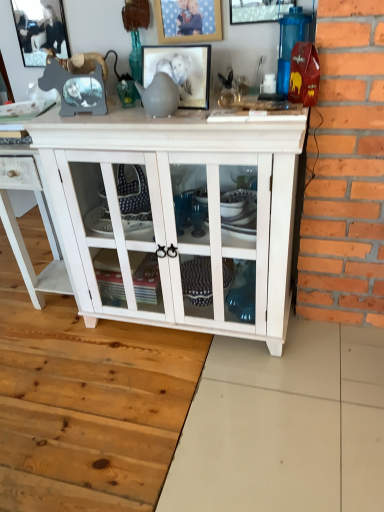
Image resolution: width=384 pixels, height=512 pixels. What do you see at coordinates (181, 71) in the screenshot?
I see `matte glass picture frame at center, which ranks as the 2th picture frame in left-to-right order` at bounding box center [181, 71].

What are the coordinates of `metallic silver picture frame at upper left, the fourth picture frame viewed from the right` in the screenshot? It's located at (40, 29).

Where is `wooden picture frame at upper center, the second picture frame from the right`? The width and height of the screenshot is (384, 512). wooden picture frame at upper center, the second picture frame from the right is located at coordinates (188, 20).

Can you confirm if white wood cupboard at center is positioned to the left of wooden picture frame at upper center, placed as the 3th picture frame when sorted from left to right?

Correct, you'll find white wood cupboard at center to the left of wooden picture frame at upper center, placed as the 3th picture frame when sorted from left to right.

The height and width of the screenshot is (512, 384). I want to click on cupboard that appears below the wooden picture frame at upper center, the second picture frame from the right (from a real-world perspective), so click(174, 209).

Which of these two, white wood cupboard at center or wooden picture frame at upper center, placed as the 3th picture frame when sorted from left to right, is smaller?

wooden picture frame at upper center, placed as the 3th picture frame when sorted from left to right, is smaller.

Is point (95, 169) positioned before point (185, 18)?

No, it is not.

Is point (30, 19) less distant than point (201, 91)?

No, it is not.

Which of these two, metallic silver picture frame at upper left, arranged as the first picture frame when viewed from the left, or matte glass picture frame at center, which ranks as the 2th picture frame in left-to-right order, is wider?

matte glass picture frame at center, which ranks as the 2th picture frame in left-to-right order, is wider.

Is metallic silver picture frame at upper left, arranged as the first picture frame when viewed from the left, surrounding matte glass picture frame at center, which is the third picture frame from right to left?

No, metallic silver picture frame at upper left, arranged as the first picture frame when viewed from the left, does not contain matte glass picture frame at center, which is the third picture frame from right to left.

In terms of size, does metallic silver picture frame at upper left, the fourth picture frame viewed from the right, appear bigger or smaller than matte glass picture frame at center, which ranks as the 2th picture frame in left-to-right order?

metallic silver picture frame at upper left, the fourth picture frame viewed from the right, is smaller than matte glass picture frame at center, which ranks as the 2th picture frame in left-to-right order.

Is metallic silver picture frame at upper center, the first picture frame in the right-to-left sequence, bigger or smaller than white wood cabinet at center?

Considering their sizes, metallic silver picture frame at upper center, the first picture frame in the right-to-left sequence, takes up less space than white wood cabinet at center.

Could you tell me if metallic silver picture frame at upper center, which is the 4th picture frame from left to right, is turned towards white wood cabinet at center?

No.

Between metallic silver picture frame at upper center, the first picture frame in the right-to-left sequence, and white wood cabinet at center, which one appears on the right side from the viewer's perspective?

metallic silver picture frame at upper center, the first picture frame in the right-to-left sequence, is more to the right.

Image resolution: width=384 pixels, height=512 pixels. I want to click on picture frame that is the 3rd object located in front of the white wood cabinet at center, so click(x=258, y=10).

Between wooden picture frame at upper center, placed as the 3th picture frame when sorted from left to right, and metallic silver picture frame at upper left, arranged as the first picture frame when viewed from the left, which one has larger width?

With larger width is wooden picture frame at upper center, placed as the 3th picture frame when sorted from left to right.

In terms of height, does wooden picture frame at upper center, placed as the 3th picture frame when sorted from left to right, look taller or shorter compared to metallic silver picture frame at upper left, the fourth picture frame viewed from the right?

In the image, wooden picture frame at upper center, placed as the 3th picture frame when sorted from left to right, appears to be shorter than metallic silver picture frame at upper left, the fourth picture frame viewed from the right.

Is wooden picture frame at upper center, the second picture frame from the right, placed right next to metallic silver picture frame at upper left, arranged as the first picture frame when viewed from the left?

wooden picture frame at upper center, the second picture frame from the right, is not next to metallic silver picture frame at upper left, arranged as the first picture frame when viewed from the left, and they're not touching.

Is metallic silver picture frame at upper left, the fourth picture frame viewed from the right, positioned with its back to white wood cupboard at center?

No.

From a real-world perspective, is metallic silver picture frame at upper left, the fourth picture frame viewed from the right, positioned above or below white wood cupboard at center?

From a real-world perspective, metallic silver picture frame at upper left, the fourth picture frame viewed from the right, is physically above white wood cupboard at center.

Which is in front, metallic silver picture frame at upper left, arranged as the first picture frame when viewed from the left, or white wood cupboard at center?

white wood cupboard at center.

From a real-world perspective, does metallic silver picture frame at upper left, the fourth picture frame viewed from the right, stand above white wood cabinet at center?

Yes, from a real-world perspective, metallic silver picture frame at upper left, the fourth picture frame viewed from the right, is above white wood cabinet at center.

Is metallic silver picture frame at upper left, arranged as the first picture frame when viewed from the left, taller or shorter than white wood cabinet at center?

In the image, metallic silver picture frame at upper left, arranged as the first picture frame when viewed from the left, appears to be shorter than white wood cabinet at center.

Which object is further away from the camera, metallic silver picture frame at upper left, arranged as the first picture frame when viewed from the left, or white wood cabinet at center?

metallic silver picture frame at upper left, arranged as the first picture frame when viewed from the left, is behind.

Does metallic silver picture frame at upper left, arranged as the first picture frame when viewed from the left, appear on the right side of white wood cabinet at center?

Indeed, metallic silver picture frame at upper left, arranged as the first picture frame when viewed from the left, is positioned on the right side of white wood cabinet at center.

From the picture: In the image, is white wood cupboard at center positioned in front of or behind matte glass picture frame at center, which ranks as the 2th picture frame in left-to-right order?

white wood cupboard at center is positioned closer to the viewer than matte glass picture frame at center, which ranks as the 2th picture frame in left-to-right order.

Is matte glass picture frame at center, which is the third picture frame from right to left, located within white wood cupboard at center?

That's incorrect, matte glass picture frame at center, which is the third picture frame from right to left, is not inside white wood cupboard at center.

Measure the distance from white wood cupboard at center to matte glass picture frame at center, which is the third picture frame from right to left.

white wood cupboard at center is 16.27 inches from matte glass picture frame at center, which is the third picture frame from right to left.

Is white wood cupboard at center thinner than matte glass picture frame at center, which is the third picture frame from right to left?

Incorrect, the width of white wood cupboard at center is not less than that of matte glass picture frame at center, which is the third picture frame from right to left.

Which picture frame is the 1st one when counting from the right side of the white wood cupboard at center? Please provide its 2D coordinates.

[(188, 20)]

Starting from the matte glass picture frame at center, which is the third picture frame from right to left, which picture frame is the 2nd one behind? Please provide its 2D coordinates.

[(40, 29)]

Looking at the image, which one is located closer to white wood cabinet at center, wooden picture frame at upper center, the second picture frame from the right, or matte glass picture frame at center, which is the third picture frame from right to left?

Based on the image, matte glass picture frame at center, which is the third picture frame from right to left, appears to be nearer to white wood cabinet at center.

When comparing their distances from white wood cupboard at center, does white wood cabinet at center or metallic silver picture frame at upper center, which is the 4th picture frame from left to right, seem closer?

white wood cabinet at center lies closer to white wood cupboard at center than the other object.

From the image, which object appears to be nearer to matte glass picture frame at center, which is the third picture frame from right to left, white wood cupboard at center or metallic silver picture frame at upper center, the first picture frame in the right-to-left sequence?

metallic silver picture frame at upper center, the first picture frame in the right-to-left sequence.

Looking at the image, which one is located further to metallic silver picture frame at upper center, which is the 4th picture frame from left to right, metallic silver picture frame at upper left, the fourth picture frame viewed from the right, or matte glass picture frame at center, which is the third picture frame from right to left?

metallic silver picture frame at upper left, the fourth picture frame viewed from the right, is positioned further to the anchor metallic silver picture frame at upper center, which is the 4th picture frame from left to right.

Based on their spatial positions, is wooden picture frame at upper center, the second picture frame from the right, or metallic silver picture frame at upper center, the first picture frame in the right-to-left sequence, closer to white wood cabinet at center?

wooden picture frame at upper center, the second picture frame from the right.

When comparing their distances from wooden picture frame at upper center, placed as the 3th picture frame when sorted from left to right, does white wood cabinet at center or white wood cupboard at center seem closer?

Among the two, white wood cupboard at center is located nearer to wooden picture frame at upper center, placed as the 3th picture frame when sorted from left to right.

Looking at the image, which one is located further to metallic silver picture frame at upper center, which is the 4th picture frame from left to right, white wood cupboard at center or matte glass picture frame at center, which ranks as the 2th picture frame in left-to-right order?

Among the two, white wood cupboard at center is located further to metallic silver picture frame at upper center, which is the 4th picture frame from left to right.

Estimate the real-world distances between objects in this image. Which object is further from white wood cabinet at center, metallic silver picture frame at upper left, the fourth picture frame viewed from the right, or wooden picture frame at upper center, the second picture frame from the right?

wooden picture frame at upper center, the second picture frame from the right, is positioned further to the anchor white wood cabinet at center.

Locate an element on the screen. Image resolution: width=384 pixels, height=512 pixels. cabinetry between metallic silver picture frame at upper center, the first picture frame in the right-to-left sequence, and white wood cupboard at center vertically is located at coordinates (42, 220).

Identify the location of picture frame between wooden picture frame at upper center, the second picture frame from the right, and white wood cupboard at center vertically. (181, 71).

The height and width of the screenshot is (512, 384). Find the location of `picture frame between metallic silver picture frame at upper left, the fourth picture frame viewed from the right, and wooden picture frame at upper center, placed as the 3th picture frame when sorted from left to right, in the horizontal direction`. picture frame between metallic silver picture frame at upper left, the fourth picture frame viewed from the right, and wooden picture frame at upper center, placed as the 3th picture frame when sorted from left to right, in the horizontal direction is located at coordinates (181, 71).

At what (x,y) coordinates should I click in order to perform the action: click on cabinetry that lies between metallic silver picture frame at upper left, the fourth picture frame viewed from the right, and white wood cupboard at center from top to bottom. Please return your answer as a coordinate pair (x, y). This screenshot has height=512, width=384. Looking at the image, I should click on (42, 220).